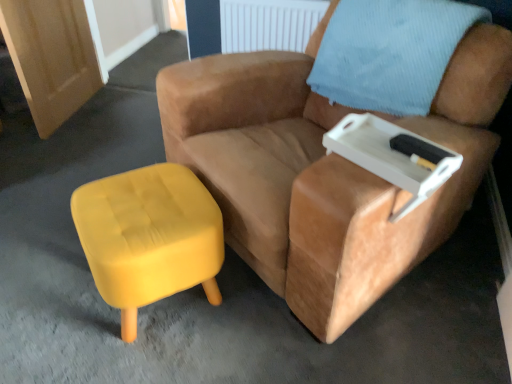
Where is `free space to the left of yellow fabric stool at lower left`? This screenshot has width=512, height=384. free space to the left of yellow fabric stool at lower left is located at coordinates (36, 312).